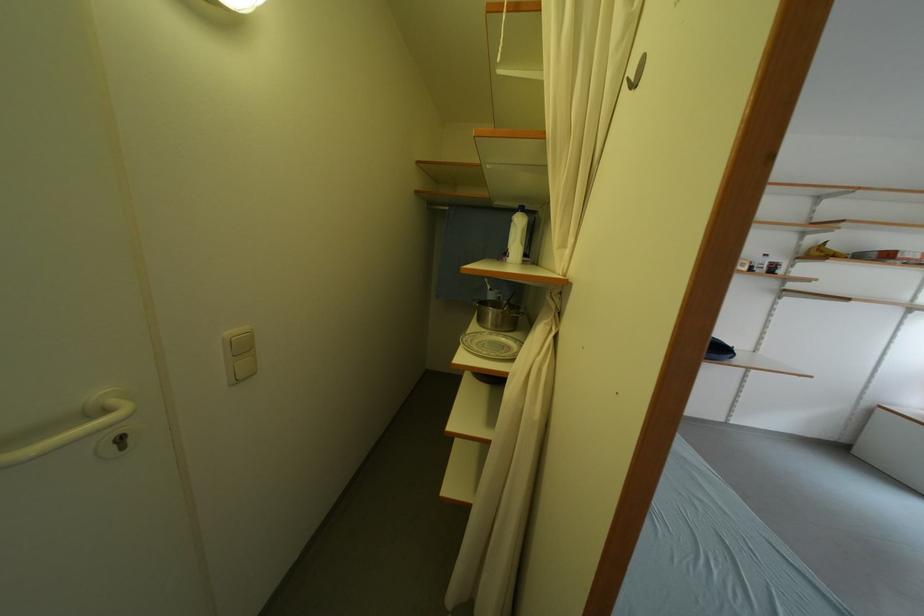
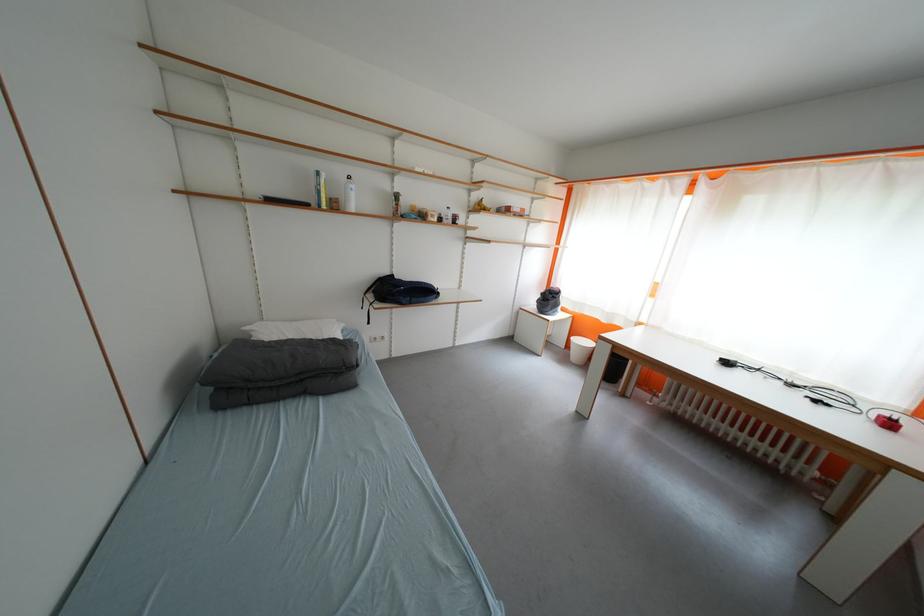
Where in the second image is the point corresponding to the point at 796,275 from the first image?

(476, 225)